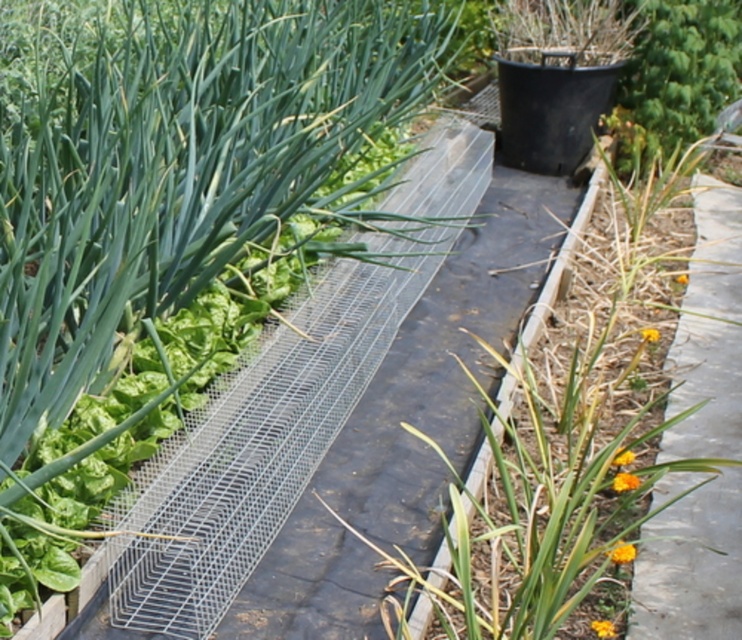
Question: Where is green leafy at center located in relation to smooth concrete path at right in the image?

Choices:
 (A) below
 (B) above

Answer: (B)

Question: Which of the following is the farthest from the observer?

Choices:
 (A) smooth concrete path at right
 (B) green leafy at center

Answer: (A)

Question: Which of the following is the closest to the observer?

Choices:
 (A) smooth concrete path at right
 (B) green leafy at center

Answer: (B)

Question: Does green leafy at center have a lesser width compared to smooth concrete path at right?

Choices:
 (A) yes
 (B) no

Answer: (B)

Question: Can you confirm if green leafy at center is positioned to the right of smooth concrete path at right?

Choices:
 (A) no
 (B) yes

Answer: (A)